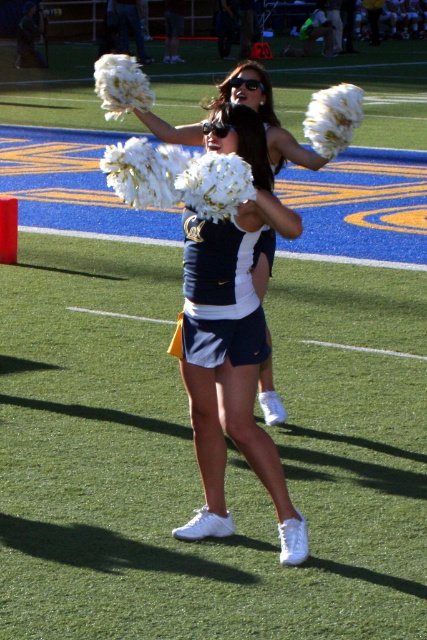
You are standing at the point marked by the coordinates point (198, 230). You want to throw a ball to a friend who is standing 10 feet away from you. Can you reach your friend with a single throw?

The distance between you and your friend is 10 feet, which is less than the 15.53 feet distance between point (198, 230) and the viewer. Therefore, you can reach your friend with a single throw.